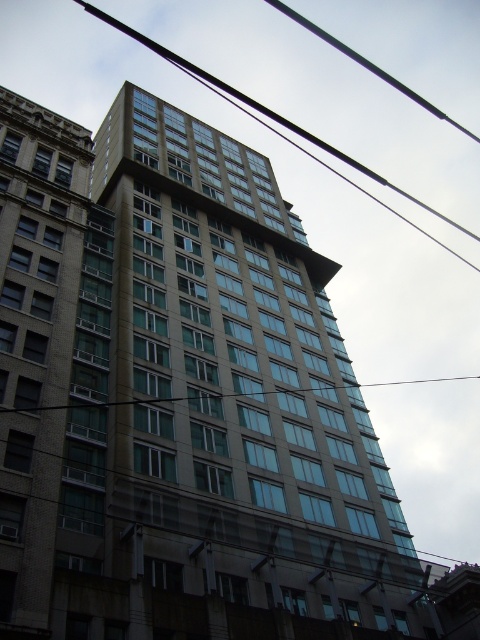
Question: Does metallic wire at upper center appear on the right side of transparent glass power line at center?

Choices:
 (A) yes
 (B) no

Answer: (B)

Question: Which of the following is the farthest from the observer?

Choices:
 (A) transparent glass power line at center
 (B) brown brick building at left
 (C) metallic wire at upper center

Answer: (C)

Question: Can you confirm if brown brick building at left is bigger than metallic wire at upper center?

Choices:
 (A) yes
 (B) no

Answer: (B)

Question: Is metallic wire at upper center thinner than transparent glass power line at center?

Choices:
 (A) yes
 (B) no

Answer: (B)

Question: Which point is closer to the camera?

Choices:
 (A) metallic wire at upper center
 (B) brown brick building at left

Answer: (B)

Question: Which of the following is the closest to the observer?

Choices:
 (A) metallic wire at upper center
 (B) brown brick building at left
 (C) transparent glass power line at center

Answer: (B)